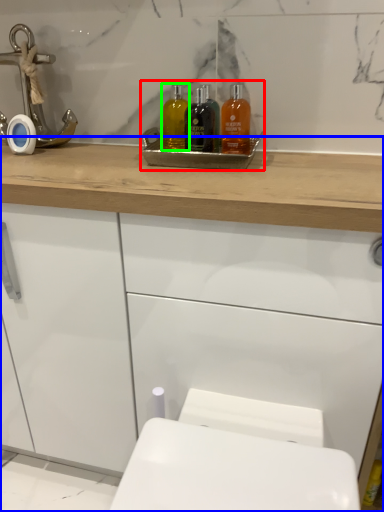
Question: Estimate the real-world distances between objects in this image. Which object is farther from sink (highlighted by a red box), bathroom cabinet (highlighted by a blue box) or mouthwash (highlighted by a green box)?

Choices:
 (A) bathroom cabinet
 (B) mouthwash

Answer: (A)